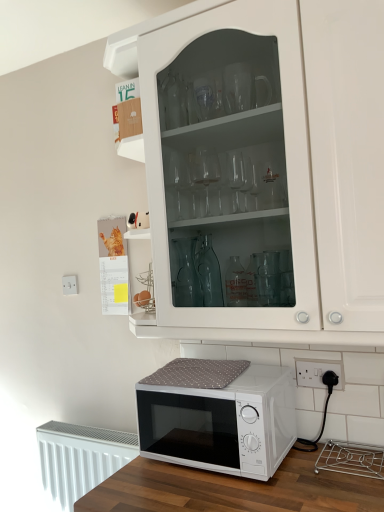
Describe the element at coordinates (70, 284) in the screenshot. I see `white plastic electric outlet at lower right, the 2th electric outlet from the front` at that location.

Locate an element on the screen. white plastic electric outlet at lower right, acting as the first electric outlet starting from the back is located at coordinates (70, 284).

Find the location of a particular element. The width and height of the screenshot is (384, 512). white plastic electric outlet at lower right, which is the 2th electric outlet from left to right is located at coordinates tap(317, 372).

Where is `white plastic electric outlet at lower right, which is counted as the first electric outlet, starting from the left`? The image size is (384, 512). white plastic electric outlet at lower right, which is counted as the first electric outlet, starting from the left is located at coordinates (70, 284).

Which is more to the right, white matte microwave at lower center or white plastic electric outlet at lower right, which is counted as the second electric outlet, starting from the right?

white matte microwave at lower center is more to the right.

Between white matte microwave at lower center and white plastic electric outlet at lower right, the 2th electric outlet from the front, which one is positioned in front?

white matte microwave at lower center.

From the image's perspective, between white matte microwave at lower center and white plastic electric outlet at lower right, acting as the first electric outlet starting from the back, which one is located above?

white plastic electric outlet at lower right, acting as the first electric outlet starting from the back, from the image's perspective.

Locate an element on the screen. This screenshot has width=384, height=512. microwave oven located underneath the white plastic electric outlet at lower right, the 2th electric outlet from the front (from a real-world perspective) is located at coordinates (218, 417).

Could you tell me if white textured radiator at lower left is facing white glass cabinet at upper center?

No, white textured radiator at lower left does not turn towards white glass cabinet at upper center.

Between white textured radiator at lower left and white glass cabinet at upper center, which one has less height?

white textured radiator at lower left.

Considering the relative sizes of white textured radiator at lower left and white glass cabinet at upper center in the image provided, is white textured radiator at lower left wider than white glass cabinet at upper center?

In fact, white textured radiator at lower left might be narrower than white glass cabinet at upper center.

Which object is further away from the camera, white textured radiator at lower left or white glass cabinet at upper center?

Positioned behind is white textured radiator at lower left.

Where is `cabinetry above the white matte microwave at lower center (from a real-world perspective)`? The width and height of the screenshot is (384, 512). cabinetry above the white matte microwave at lower center (from a real-world perspective) is located at coordinates (254, 212).

Is the position of white glass cabinet at upper center more distant than that of white matte microwave at lower center?

No, white glass cabinet at upper center is in front of white matte microwave at lower center.

How different are the orientations of white glass cabinet at upper center and white matte microwave at lower center in degrees?

white glass cabinet at upper center and white matte microwave at lower center are facing 0.103 degrees away from each other.

Which of these two, white glass cabinet at upper center or white matte microwave at lower center, is bigger?

Bigger between the two is white glass cabinet at upper center.

Which of these two, white plastic electric outlet at lower right, which is the 2th electric outlet from left to right, or white matte microwave at lower center, is bigger?

Bigger between the two is white matte microwave at lower center.

Based on the photo, is white plastic electric outlet at lower right, the 1th electric outlet when ordered from front to back, closer to the viewer compared to white matte microwave at lower center?

No, white plastic electric outlet at lower right, the 1th electric outlet when ordered from front to back, is behind white matte microwave at lower center.

Which object is wider, white plastic electric outlet at lower right, which is the 2th electric outlet from left to right, or white matte microwave at lower center?

white matte microwave at lower center is wider.

Does white plastic electric outlet at lower right, positioned as the second electric outlet in top-to-bottom order, appear on the left side of white matte microwave at lower center?

No.

From the image's perspective, is white textured radiator at lower left under white matte microwave at lower center?

Indeed, from the image's perspective, white textured radiator at lower left is shown beneath white matte microwave at lower center.

Would you say white textured radiator at lower left contains white matte microwave at lower center?

No, white matte microwave at lower center is not a part of white textured radiator at lower left.

Is white textured radiator at lower left further to the viewer compared to white matte microwave at lower center?

Yes, the depth of white textured radiator at lower left is greater than that of white matte microwave at lower center.

What's the angular difference between white textured radiator at lower left and white matte microwave at lower center's facing directions?

There is a 0.00109-degree angle between the facing directions of white textured radiator at lower left and white matte microwave at lower center.

Would you consider white matte microwave at lower center to be distant from white glass cabinet at upper center?

That's not correct — white matte microwave at lower center is a little close to white glass cabinet at upper center.

Does white matte microwave at lower center have a greater width compared to white glass cabinet at upper center?

No, white matte microwave at lower center is not wider than white glass cabinet at upper center.

From the image's perspective, relative to white glass cabinet at upper center, is white matte microwave at lower center above or below?

From the image's perspective, white matte microwave at lower center appears below white glass cabinet at upper center.

Is the surface of white matte microwave at lower center in direct contact with white plastic electric outlet at lower right, positioned as the second electric outlet in top-to-bottom order?

white matte microwave at lower center and white plastic electric outlet at lower right, positioned as the second electric outlet in top-to-bottom order, are clearly separated.

Is white matte microwave at lower center completely or partially outside of white plastic electric outlet at lower right, positioned as the second electric outlet in top-to-bottom order?

Indeed, white matte microwave at lower center is completely outside white plastic electric outlet at lower right, positioned as the second electric outlet in top-to-bottom order.

How different are the orientations of white matte microwave at lower center and white plastic electric outlet at lower right, the 1th electric outlet when ordered from front to back, in degrees?

They differ by 0.00284 degrees in their facing directions.

Is white matte microwave at lower center at the left side of white plastic electric outlet at lower right, which appears as the 1th electric outlet when viewed from the right?

Correct, you'll find white matte microwave at lower center to the left of white plastic electric outlet at lower right, which appears as the 1th electric outlet when viewed from the right.

Where is `electric outlet that appears on the left of white matte microwave at lower center`? electric outlet that appears on the left of white matte microwave at lower center is located at coordinates (70, 284).

Identify the location of radiator that appears below the white glass cabinet at upper center (from the image's perspective). (80, 458).

Estimate the real-world distances between objects in this image. Which object is closer to white textured radiator at lower left, white plastic electric outlet at lower right, which is counted as the second electric outlet, starting from the right, or white glass cabinet at upper center?

white plastic electric outlet at lower right, which is counted as the second electric outlet, starting from the right.

Based on their spatial positions, is white matte microwave at lower center or white glass cabinet at upper center closer to white plastic electric outlet at lower right, the 2th electric outlet from the front?

white matte microwave at lower center is closer to white plastic electric outlet at lower right, the 2th electric outlet from the front.

Considering their positions, is white textured radiator at lower left positioned further to white glass cabinet at upper center than white plastic electric outlet at lower right, which is counted as the second electric outlet, starting from the right?

The object further to white glass cabinet at upper center is white plastic electric outlet at lower right, which is counted as the second electric outlet, starting from the right.

Estimate the real-world distances between objects in this image. Which object is closer to white plastic electric outlet at lower right, which is counted as the second electric outlet, starting from the right, white matte microwave at lower center or white plastic electric outlet at lower right, positioned as the second electric outlet in top-to-bottom order?

white matte microwave at lower center is positioned closer to the anchor white plastic electric outlet at lower right, which is counted as the second electric outlet, starting from the right.

Estimate the real-world distances between objects in this image. Which object is closer to white matte microwave at lower center, white textured radiator at lower left or white plastic electric outlet at lower right, which is the first electric outlet from top to bottom?

white textured radiator at lower left lies closer to white matte microwave at lower center than the other object.

Considering their positions, is white matte microwave at lower center positioned further to white glass cabinet at upper center than white plastic electric outlet at lower right, which appears as the 1th electric outlet when viewed from the right?

white plastic electric outlet at lower right, which appears as the 1th electric outlet when viewed from the right.

Which object lies further to the anchor point white textured radiator at lower left, white matte microwave at lower center or white plastic electric outlet at lower right, which appears as the 1th electric outlet when viewed from the right?

The object further to white textured radiator at lower left is white plastic electric outlet at lower right, which appears as the 1th electric outlet when viewed from the right.

Considering their positions, is white glass cabinet at upper center positioned further to white textured radiator at lower left than white plastic electric outlet at lower right, which is counted as the second electric outlet, starting from the right?

Among the two, white glass cabinet at upper center is located further to white textured radiator at lower left.

The height and width of the screenshot is (512, 384). Find the location of `radiator located between white plastic electric outlet at lower right, the 2th electric outlet in the bottom-to-top sequence, and white plastic electric outlet at lower right, acting as the first electric outlet starting from the bottom, in the left-right direction`. radiator located between white plastic electric outlet at lower right, the 2th electric outlet in the bottom-to-top sequence, and white plastic electric outlet at lower right, acting as the first electric outlet starting from the bottom, in the left-right direction is located at coordinates (80, 458).

This screenshot has height=512, width=384. Find the location of `microwave oven between white plastic electric outlet at lower right, which is the first electric outlet from top to bottom, and white textured radiator at lower left in the up-down direction`. microwave oven between white plastic electric outlet at lower right, which is the first electric outlet from top to bottom, and white textured radiator at lower left in the up-down direction is located at coordinates (218, 417).

Where is `microwave oven located between white plastic electric outlet at lower right, which is the first electric outlet from top to bottom, and white plastic electric outlet at lower right, positioned as the second electric outlet in top-to-bottom order, in the left-right direction`? microwave oven located between white plastic electric outlet at lower right, which is the first electric outlet from top to bottom, and white plastic electric outlet at lower right, positioned as the second electric outlet in top-to-bottom order, in the left-right direction is located at coordinates (218, 417).

Find the location of `microwave oven that lies between white glass cabinet at upper center and white textured radiator at lower left from top to bottom`. microwave oven that lies between white glass cabinet at upper center and white textured radiator at lower left from top to bottom is located at coordinates (218, 417).